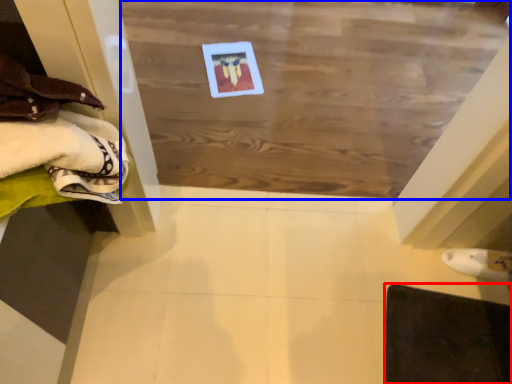
Question: Which object appears farthest to the camera in this image, furniture (highlighted by a red box) or plywood (highlighted by a blue box)?

Choices:
 (A) furniture
 (B) plywood

Answer: (B)